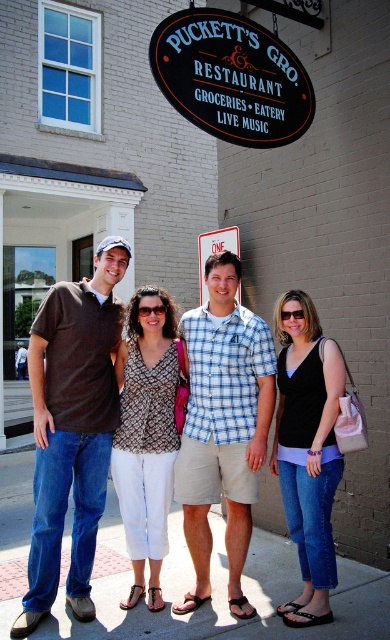
Who is more distant from viewer, (152, 323) or (212, 496)?

Point (152, 323)

Who is more forward, (37, 422) or (244, 433)?

Point (37, 422)

Where is `brown cotton shirt at center`? This screenshot has height=640, width=390. brown cotton shirt at center is located at coordinates (226, 424).

Does brown cotton shirt at center have a greater width compared to brushed metal sign at center?

Yes, brown cotton shirt at center is wider than brushed metal sign at center.

Which is above, brown cotton shirt at center or brushed metal sign at center?

Positioned higher is brushed metal sign at center.

Locate an element on the screen. brown cotton shirt at center is located at coordinates (226, 424).

Where is `brown cotton shirt at center`? The height and width of the screenshot is (640, 390). brown cotton shirt at center is located at coordinates (226, 424).

Can you confirm if matte brown polo shirt at left is bigger than black denim jeans at center?

Indeed, matte brown polo shirt at left has a larger size compared to black denim jeans at center.

Can you confirm if matte brown polo shirt at left is wider than black denim jeans at center?

Yes, matte brown polo shirt at left is wider than black denim jeans at center.

Where is `matte brown polo shirt at left`? Image resolution: width=390 pixels, height=640 pixels. matte brown polo shirt at left is located at coordinates (72, 429).